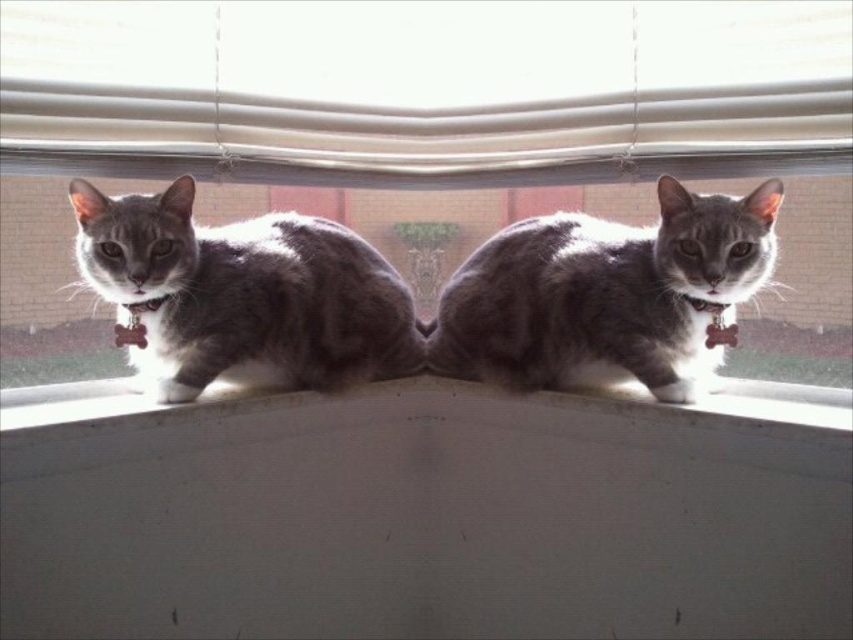
Question: Considering the relative positions of white matte window sill at center and gray fur cat at center in the image provided, where is white matte window sill at center located with respect to gray fur cat at center?

Choices:
 (A) left
 (B) right

Answer: (A)

Question: Estimate the real-world distances between objects in this image. Which object is closer to the transparent glass window at center?

Choices:
 (A) white matte window sill at center
 (B) gray fur cat at center
 (C) white fabric curtain at upper center

Answer: (C)

Question: Considering the relative positions of white fabric curtain at upper center and gray fur cat at left in the image provided, where is white fabric curtain at upper center located with respect to gray fur cat at left?

Choices:
 (A) above
 (B) below

Answer: (A)

Question: Which object appears closest to the camera in this image?

Choices:
 (A) gray fur cat at left
 (B) gray fur cat at center

Answer: (A)

Question: Does white matte window sill at center appear under white fabric curtain at upper center?

Choices:
 (A) no
 (B) yes

Answer: (B)

Question: Based on their relative distances, which object is farther from the transparent glass window at center?

Choices:
 (A) gray fur cat at left
 (B) white matte window sill at center

Answer: (B)